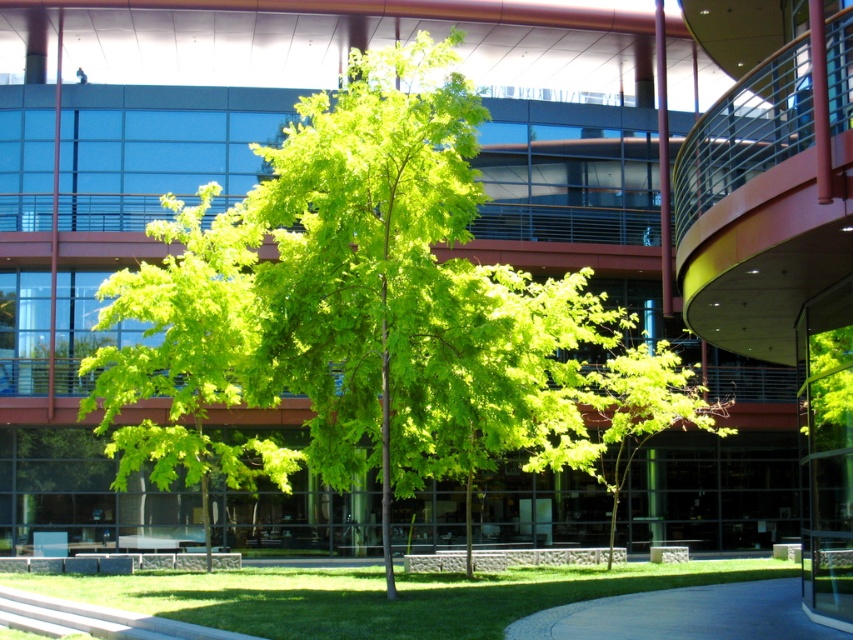
Question: Which of the following is the farthest from the observer?

Choices:
 (A) (166, 612)
 (B) (727, 636)

Answer: (A)

Question: Is green grass at lower center wider than concrete pavement at lower center?

Choices:
 (A) no
 (B) yes

Answer: (B)

Question: Among these points, which one is nearest to the camera?

Choices:
 (A) [306, 592]
 (B) [706, 620]

Answer: (B)

Question: Considering the relative positions of green leafy tree at center and green grass at lower center in the image provided, where is green leafy tree at center located with respect to green grass at lower center?

Choices:
 (A) right
 (B) left

Answer: (B)

Question: Based on their relative distances, which object is farther from the green leafy tree at center?

Choices:
 (A) green grass at lower center
 (B) concrete pavement at lower center

Answer: (B)

Question: Does green leafy tree at center have a lesser width compared to green grass at lower center?

Choices:
 (A) no
 (B) yes

Answer: (B)